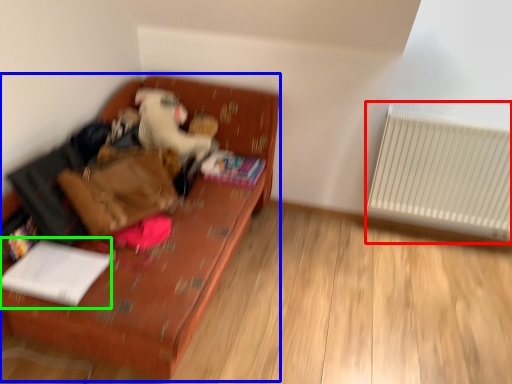
Question: Which object is positioned farthest from radiator (highlighted by a red box)? Select from furniture (highlighted by a blue box) and book (highlighted by a green box).

Choices:
 (A) furniture
 (B) book

Answer: (B)